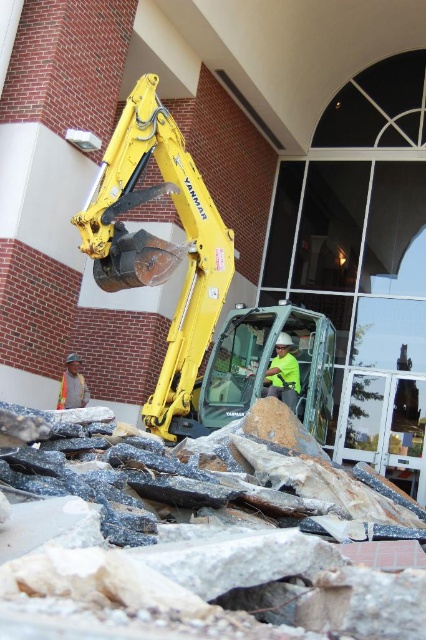
You are a construction supervisor observing the demolition site. You notice the yellow metallic excavator at center and the neon green safety vest at center. Which object appears bigger in the scene?

The yellow metallic excavator at center is larger in size than the neon green safety vest at center, so the excavator appears bigger.

From the picture: You are a construction supervisor who needs to ensure safety distances between workers. Given that the minimum safe distance between workers on a demolition site is 10 feet, can you confirm if the distance between the neon green safety vest at center and the orange safety vest at lower left meets the safety requirement?

The neon green safety vest at center and the orange safety vest at lower left are 11.28 feet apart from each other, which exceeds the minimum safe distance of 10 feet. Therefore, the current distance meets the safety requirement.